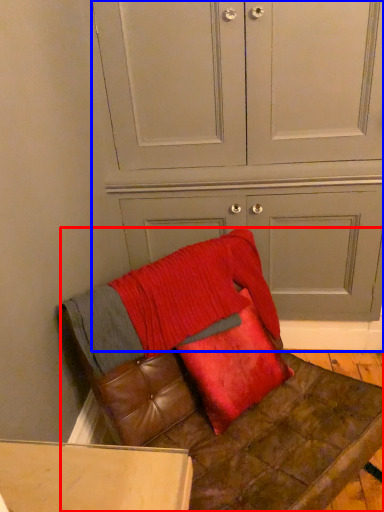
Question: Which object is further to the camera taking this photo, furniture (highlighted by a red box) or dresser (highlighted by a blue box)?

Choices:
 (A) furniture
 (B) dresser

Answer: (B)